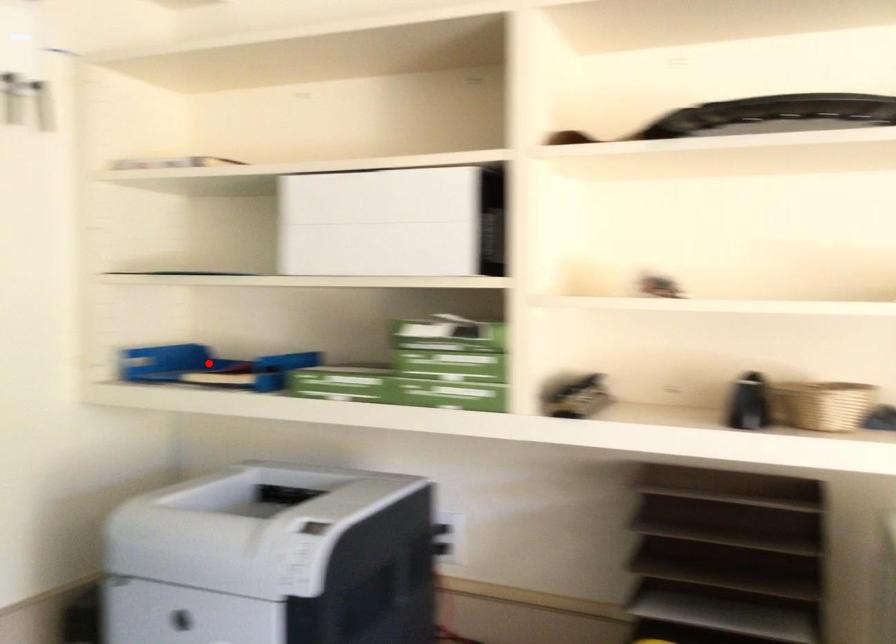
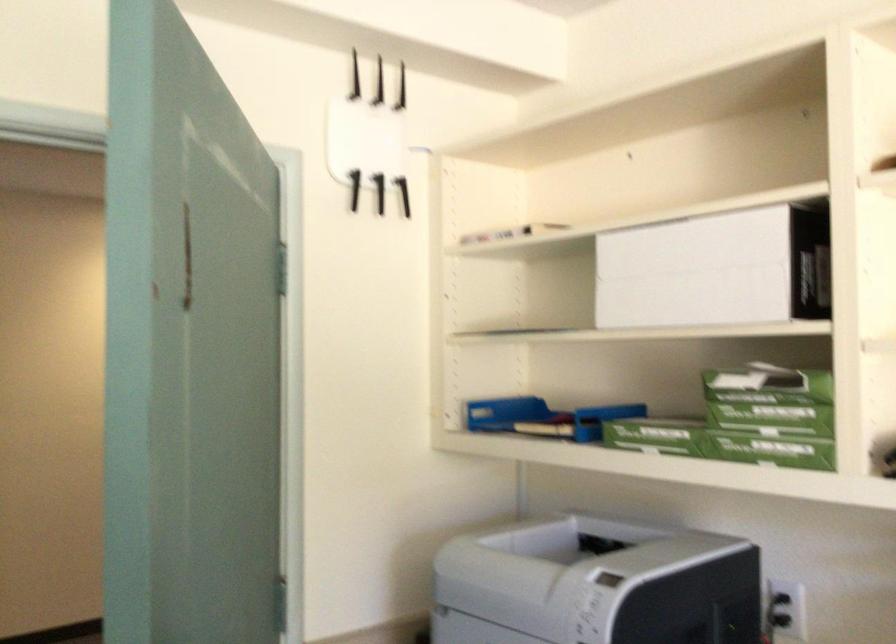
The point at the highlighted location is marked in the first image. Where is the corresponding point in the second image?

(543, 418)